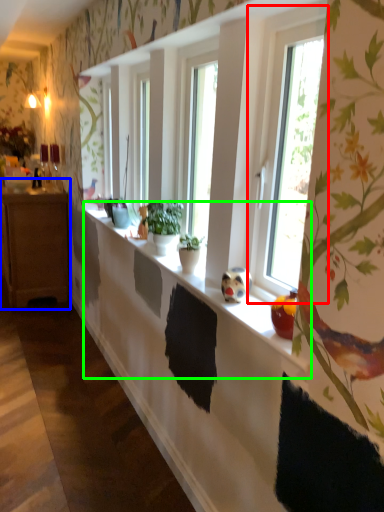
Question: Which object is positioned closest to window (highlighted by a red box)? Select from cabinetry (highlighted by a blue box) and window sill (highlighted by a green box).

Choices:
 (A) cabinetry
 (B) window sill

Answer: (B)